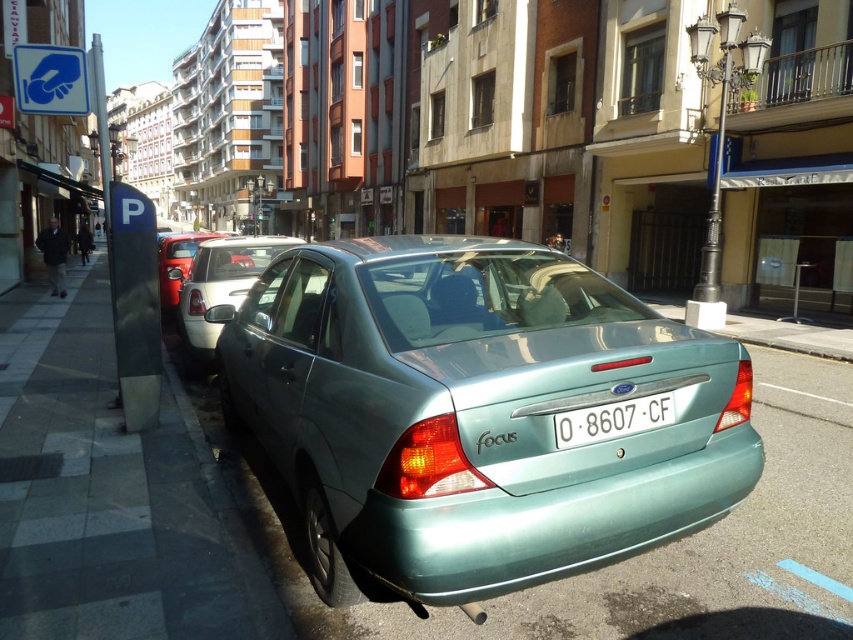
Question: Is metallic teal sedan at center wider than dark gray metallic parking meter at left?

Choices:
 (A) yes
 (B) no

Answer: (A)

Question: Does metallic silver sedan at center appear on the right side of metallic silver hatchback at center?

Choices:
 (A) yes
 (B) no

Answer: (A)

Question: Which point is closer to the camera taking this photo?

Choices:
 (A) (184, 621)
 (B) (262, 253)
 (C) (131, 300)

Answer: (A)

Question: Observing the image, what is the correct spatial positioning of gray concrete sidewalk at lower left in reference to metallic silver sedan at center?

Choices:
 (A) above
 (B) below

Answer: (B)

Question: Among these points, which one is nearest to the camera?

Choices:
 (A) (125, 406)
 (B) (61, 404)
 (C) (302, 333)
 (D) (664, 422)

Answer: (D)

Question: Based on their relative distances, which object is nearer to the dark gray metallic parking meter at left?

Choices:
 (A) metallic teal sedan at center
 (B) white plastic license plate at center
 (C) metallic silver hatchback at center

Answer: (A)